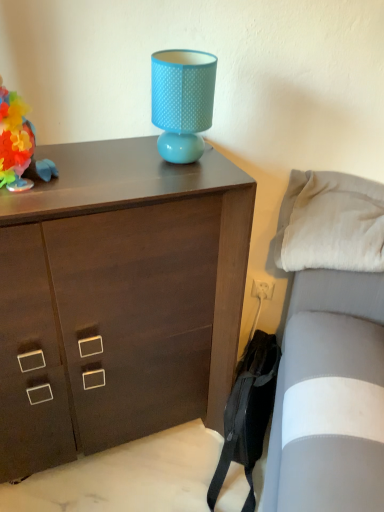
Question: Can you confirm if matte blue lampshade at upper center is positioned to the left of white soft pillow at right?

Choices:
 (A) no
 (B) yes

Answer: (B)

Question: Is there a large distance between matte blue lampshade at upper center and white soft pillow at right?

Choices:
 (A) no
 (B) yes

Answer: (A)

Question: Does matte blue lampshade at upper center touch white soft pillow at right?

Choices:
 (A) no
 (B) yes

Answer: (A)

Question: Can you confirm if matte blue lampshade at upper center is wider than white soft pillow at right?

Choices:
 (A) no
 (B) yes

Answer: (A)

Question: Is white soft pillow at right surrounded by matte blue lampshade at upper center?

Choices:
 (A) no
 (B) yes

Answer: (A)

Question: Is matte blue lampshade at upper center smaller than white soft pillow at right?

Choices:
 (A) yes
 (B) no

Answer: (A)

Question: From a real-world perspective, is dark wood chest of drawers at upper center located higher than white soft pillow at right?

Choices:
 (A) yes
 (B) no

Answer: (B)

Question: Considering the relative positions of dark wood chest of drawers at upper center and white soft pillow at right in the image provided, is dark wood chest of drawers at upper center behind white soft pillow at right?

Choices:
 (A) no
 (B) yes

Answer: (A)

Question: Are dark wood chest of drawers at upper center and white soft pillow at right far apart?

Choices:
 (A) no
 (B) yes

Answer: (A)

Question: From a real-world perspective, is dark wood chest of drawers at upper center below white soft pillow at right?

Choices:
 (A) no
 (B) yes

Answer: (B)

Question: Is dark wood chest of drawers at upper center bigger than white soft pillow at right?

Choices:
 (A) yes
 (B) no

Answer: (A)

Question: Can you confirm if dark wood chest of drawers at upper center is shorter than white soft pillow at right?

Choices:
 (A) no
 (B) yes

Answer: (A)

Question: Is white soft pillow at right closer to camera compared to multicolored paper flower at left?

Choices:
 (A) yes
 (B) no

Answer: (B)